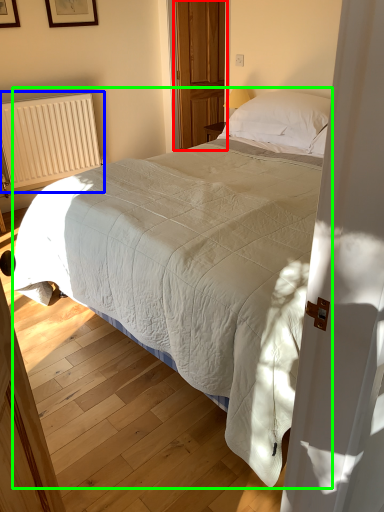
Question: Based on their relative distances, which object is nearer to screen door (highlighted by a red box)? Choose from radiator (highlighted by a blue box) and bed (highlighted by a green box).

Choices:
 (A) radiator
 (B) bed

Answer: (A)